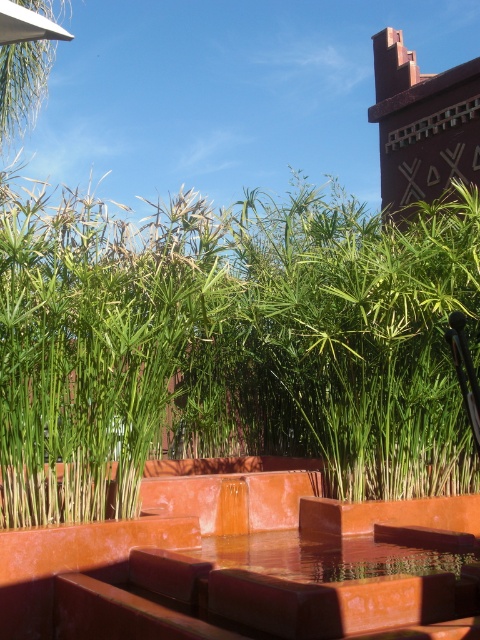
You are a gardener standing near the water feature and see the green leafy plant at center and the transparent glass water at center. Which object is positioned higher in the scene?

The green leafy plant at center is above the transparent glass water at center, so it is positioned higher in the scene.